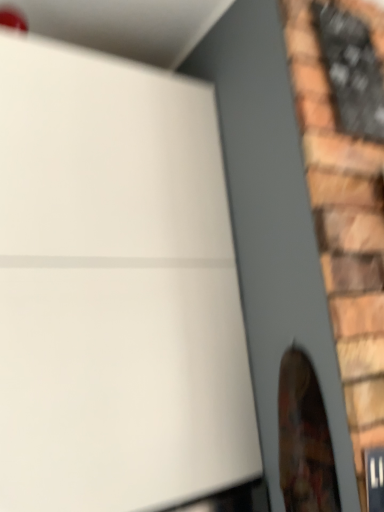
This screenshot has width=384, height=512. In order to click on white matte projector screen at left in this screenshot , I will do `click(115, 289)`.

This screenshot has height=512, width=384. What do you see at coordinates (115, 289) in the screenshot?
I see `white matte projector screen at left` at bounding box center [115, 289].

What is the approximate height of white matte projector screen at left?

3.54 feet.

Identify the location of white matte projector screen at left. (115, 289).